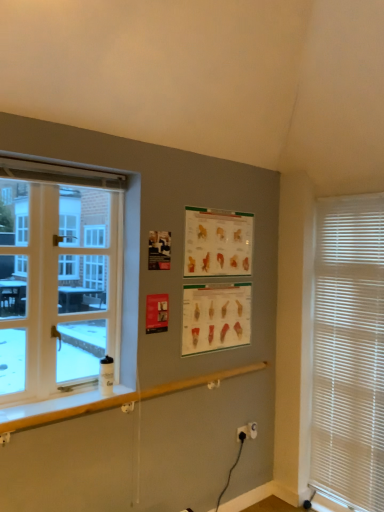
Question: Is matte paper poster at center, which is the 2th poster page in top-to-bottom order, positioned with its back to matte paper poster at upper center, acting as the first poster page starting from the top?

Choices:
 (A) yes
 (B) no

Answer: (B)

Question: Considering the relative sizes of matte paper poster at center, which is the 2th poster page in top-to-bottom order, and matte paper poster at upper center, which is the second poster page in bottom-to-top order, in the image provided, is matte paper poster at center, which is the 2th poster page in top-to-bottom order, wider than matte paper poster at upper center, which is the second poster page in bottom-to-top order,?

Choices:
 (A) no
 (B) yes

Answer: (B)

Question: Does matte paper poster at center, which is the 2th poster page in top-to-bottom order, have a lesser height compared to matte paper poster at upper center, acting as the first poster page starting from the top?

Choices:
 (A) yes
 (B) no

Answer: (B)

Question: From a real-world perspective, is matte paper poster at center, which is the 1th poster page from bottom to top, positioned under matte paper poster at upper center, which is the second poster page in bottom-to-top order, based on gravity?

Choices:
 (A) yes
 (B) no

Answer: (A)

Question: Can you confirm if matte paper poster at center, which is the 2th poster page in top-to-bottom order, is taller than matte paper poster at upper center, which is the second poster page in bottom-to-top order?

Choices:
 (A) no
 (B) yes

Answer: (B)

Question: Considering the positions of point (127, 401) and point (188, 219), is point (127, 401) closer or farther from the camera than point (188, 219)?

Choices:
 (A) farther
 (B) closer

Answer: (B)

Question: Visually, is white wood window sill at lower left positioned to the left or to the right of matte paper poster at upper center, acting as the first poster page starting from the top?

Choices:
 (A) right
 (B) left

Answer: (B)

Question: In the image, is white wood window sill at lower left positioned in front of or behind matte paper poster at upper center, acting as the first poster page starting from the top?

Choices:
 (A) front
 (B) behind

Answer: (A)

Question: From the image's perspective, is white wood window sill at lower left positioned above or below matte paper poster at upper center, acting as the first poster page starting from the top?

Choices:
 (A) below
 (B) above

Answer: (A)

Question: From the image's perspective, is black plastic electric outlet at lower center, the 3th electric outlet viewed from the right, located above or below matte paper poster at upper center, which is the second poster page in bottom-to-top order?

Choices:
 (A) below
 (B) above

Answer: (A)

Question: From their relative heights in the image, would you say black plastic electric outlet at lower center, the 3th electric outlet viewed from the right, is taller or shorter than matte paper poster at upper center, which is the second poster page in bottom-to-top order?

Choices:
 (A) short
 (B) tall

Answer: (A)

Question: In terms of width, does black plastic electric outlet at lower center, which is the 1th electric outlet from left to right, look wider or thinner when compared to matte paper poster at upper center, acting as the first poster page starting from the top?

Choices:
 (A) thin
 (B) wide

Answer: (B)

Question: Is point (244, 426) closer or farther from the camera than point (187, 245)?

Choices:
 (A) farther
 (B) closer

Answer: (A)

Question: In terms of height, does white wood window sill at lower left look taller or shorter compared to matte paper poster at center, which is the 1th poster page from bottom to top?

Choices:
 (A) tall
 (B) short

Answer: (B)

Question: Based on their positions, is white wood window sill at lower left located to the left or right of matte paper poster at center, which is the 2th poster page in top-to-bottom order?

Choices:
 (A) right
 (B) left

Answer: (B)